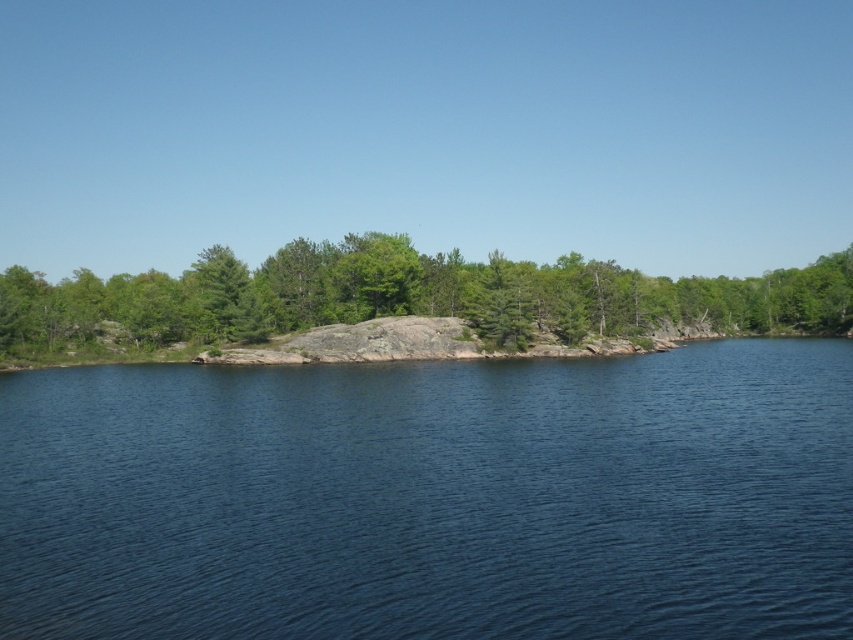
You are standing on the green textured rock at center and want to see the blue water at center. In which direction should you look?

You should look downward because the blue water at center is positioned under the green textured rock at center.

You are standing at the edge of the water and see a point marked at coordinates (433,497). According to the scene description, what is the color of the object located at that point?

The point at coordinates (433,497) corresponds to blue water at center, so the color is blue.